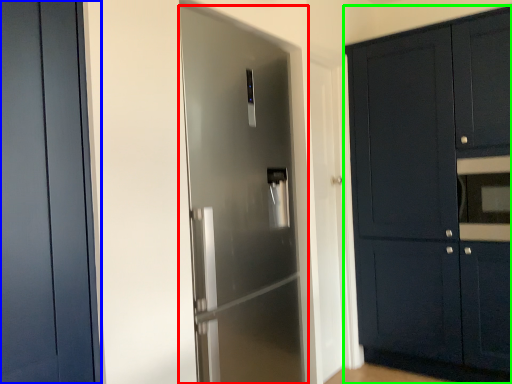
Question: Estimate the real-world distances between objects in this image. Which object is closer to door (highlighted by a red box), door (highlighted by a blue box) or cabinetry (highlighted by a green box)?

Choices:
 (A) door
 (B) cabinetry

Answer: (A)